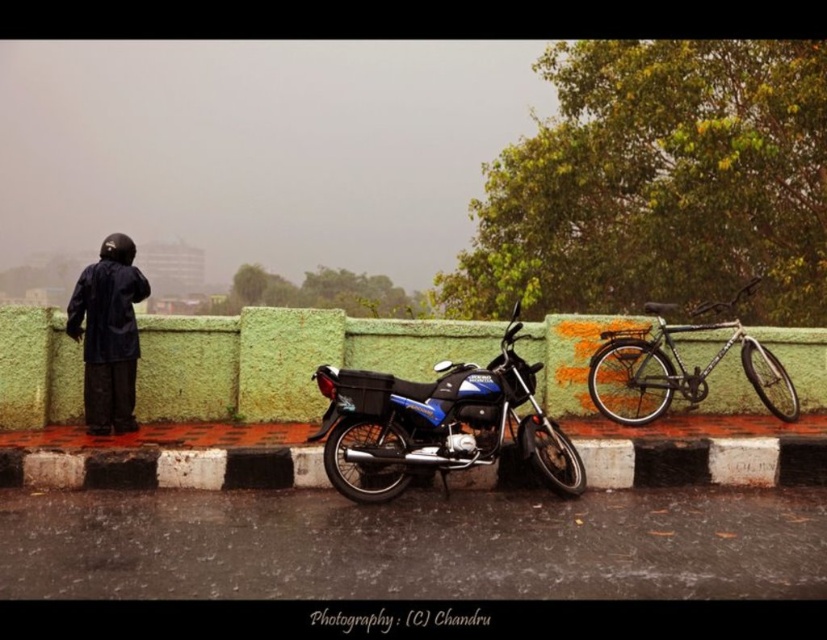
Question: Can you confirm if black rubber curb at lower center is positioned above black matte jacket at left?

Choices:
 (A) yes
 (B) no

Answer: (B)

Question: Which object appears closest to the camera in this image?

Choices:
 (A) black rubber curb at lower center
 (B) green concrete barrier at center
 (C) black matte jacket at left

Answer: (A)

Question: Is the position of green concrete barrier at center less distant than that of black rubber curb at lower center?

Choices:
 (A) no
 (B) yes

Answer: (A)

Question: Is black matte jacket at left positioned before silver metallic bicycle at right?

Choices:
 (A) yes
 (B) no

Answer: (A)

Question: Which point is closer to the camera?

Choices:
 (A) blue metallic motorcycle at center
 (B) silver metallic bicycle at right
 (C) green concrete barrier at center
 (D) black rubber curb at lower center

Answer: (A)

Question: Which point is farther to the camera?

Choices:
 (A) silver metallic bicycle at right
 (B) black matte jacket at left
 (C) blue metallic motorcycle at center

Answer: (A)